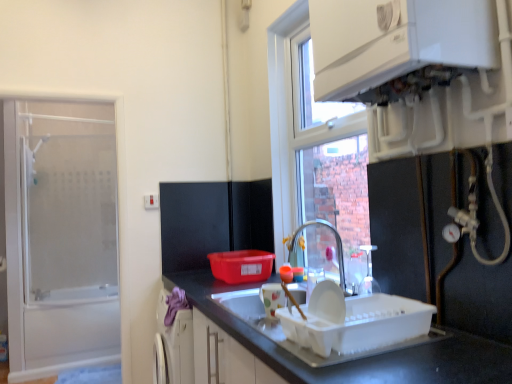
In order to face transparent glass shower door at left, should I rotate leftwards or rightwards?

You should look left and rotate roughly 25.323 degrees.

Measure the distance between point (x=11, y=239) and camera.

They are 3.40 meters apart.

Identify the location of glossy metallic tap at center. The height and width of the screenshot is (384, 512). (336, 245).

Identify the location of white glossy boiler at upper right. (396, 40).

Based on their positions, is glossy metallic tap at center located to the left or right of white glossy countertop at lower center?

In the image, glossy metallic tap at center appears on the right side of white glossy countertop at lower center.

Is point (309, 223) positioned after point (252, 338)?

That is True.

Is glossy metallic tap at center not inside white glossy countertop at lower center?

Yes, glossy metallic tap at center is not within white glossy countertop at lower center.

Considering the sizes of objects glossy metallic tap at center and white glossy countertop at lower center in the image provided, who is smaller, glossy metallic tap at center or white glossy countertop at lower center?

With smaller size is glossy metallic tap at center.

Based on the photo, is glossy metallic tap at center beside white glossy boiler at upper right?

glossy metallic tap at center is not next to white glossy boiler at upper right, and they're not touching.

Is glossy metallic tap at center shorter than white glossy boiler at upper right?

Yes, glossy metallic tap at center is shorter than white glossy boiler at upper right.

From the image's perspective, is glossy metallic tap at center located above white glossy boiler at upper right?

No.

Is glossy metallic tap at center bigger than white glossy boiler at upper right?

No, glossy metallic tap at center is not bigger than white glossy boiler at upper right.

Is point (432, 61) behind point (214, 279)?

No, (432, 61) is in front of (214, 279).

Looking at their sizes, would you say white glossy boiler at upper right is wider or thinner than white glossy countertop at lower center?

white glossy boiler at upper right is thinner than white glossy countertop at lower center.

What are the coordinates of `countertop that is in front of the white glossy boiler at upper right` in the screenshot? It's located at (360, 359).

Is glossy metallic tap at center inside the boundaries of transparent glass shower door at left, or outside?

glossy metallic tap at center exists outside the volume of transparent glass shower door at left.

Between glossy metallic tap at center and transparent glass shower door at left, which one appears on the right side from the viewer's perspective?

glossy metallic tap at center is more to the right.

Which is in front, point (294, 232) or point (106, 362)?

The point (294, 232) is closer.

Is glossy metallic tap at center far away from transparent glass shower door at left?

Yes, glossy metallic tap at center and transparent glass shower door at left are quite far apart.

Is transparent glass shower door at left not close to white glossy boiler at upper right?

Yes.

Is transparent glass shower door at left oriented towards white glossy boiler at upper right?

No, transparent glass shower door at left is not aimed at white glossy boiler at upper right.

Is transparent glass shower door at left smaller than white glossy boiler at upper right?

Incorrect, transparent glass shower door at left is not smaller in size than white glossy boiler at upper right.

Which object is positioned more to the right, transparent glass shower door at left or white glossy boiler at upper right?

white glossy boiler at upper right.

Does white glossy boiler at upper right appear on the left side of glossy metallic tap at center?

Incorrect, white glossy boiler at upper right is not on the left side of glossy metallic tap at center.

Can you tell me how much white glossy boiler at upper right and glossy metallic tap at center differ in facing direction?

The angle between the facing direction of white glossy boiler at upper right and the facing direction of glossy metallic tap at center is 42.6 degrees.

Would you consider white glossy boiler at upper right to be distant from glossy metallic tap at center?

Actually, white glossy boiler at upper right and glossy metallic tap at center are a little close together.

Is point (319, 70) closer or farther from the camera than point (336, 239)?

Point (319, 70) is positioned closer to the camera compared to point (336, 239).

Identify the location of screen door that appears behind the white glossy countertop at lower center. (61, 236).

Which is farther, (22, 147) or (498, 355)?

The point (22, 147) is behind.

Looking at their sizes, would you say transparent glass shower door at left is wider or thinner than white glossy countertop at lower center?

Clearly, transparent glass shower door at left has less width compared to white glossy countertop at lower center.

Considering the positions of objects transparent glass shower door at left and white glossy countertop at lower center in the image provided, who is in front, transparent glass shower door at left or white glossy countertop at lower center?

white glossy countertop at lower center is more forward.

In the image, there is a glossy metallic tap at center. At what (x,y) coordinates should I click in order to perform the action: click on countertop below it (from the image's perspective). Please return your answer as a coordinate pair (x, y). Looking at the image, I should click on (360, 359).

The width and height of the screenshot is (512, 384). What are the coordinates of `cabinetry in front of the glossy metallic tap at center` in the screenshot? It's located at (396, 40).

Estimate the real-world distances between objects in this image. Which object is closer to transparent glass shower door at left, white glossy countertop at lower center or white glossy boiler at upper right?

Based on the image, white glossy countertop at lower center appears to be nearer to transparent glass shower door at left.

Consider the image. Considering their positions, is white glossy boiler at upper right positioned closer to white glossy countertop at lower center than glossy metallic tap at center?

Among the two, glossy metallic tap at center is located nearer to white glossy countertop at lower center.

Which object lies nearer to the anchor point white glossy boiler at upper right, transparent glass shower door at left or white glossy countertop at lower center?

white glossy countertop at lower center.

Based on their spatial positions, is glossy metallic tap at center or transparent glass shower door at left further from white glossy countertop at lower center?

transparent glass shower door at left.

Based on their spatial positions, is transparent glass shower door at left or white glossy countertop at lower center closer to glossy metallic tap at center?

Among the two, white glossy countertop at lower center is located nearer to glossy metallic tap at center.

Which object lies further to the anchor point glossy metallic tap at center, white glossy boiler at upper right or transparent glass shower door at left?

Based on the image, transparent glass shower door at left appears to be further to glossy metallic tap at center.

Estimate the real-world distances between objects in this image. Which object is closer to white glossy boiler at upper right, glossy metallic tap at center or transparent glass shower door at left?

Among the two, glossy metallic tap at center is located nearer to white glossy boiler at upper right.

From the picture: Considering their positions, is white glossy boiler at upper right positioned closer to white glossy countertop at lower center than transparent glass shower door at left?

white glossy boiler at upper right.

Where is `countertop located between transparent glass shower door at left and glossy metallic tap at center in the left-right direction`? The height and width of the screenshot is (384, 512). countertop located between transparent glass shower door at left and glossy metallic tap at center in the left-right direction is located at coordinates (360, 359).

Where is `tap between white glossy boiler at upper right and white glossy countertop at lower center vertically`? The height and width of the screenshot is (384, 512). tap between white glossy boiler at upper right and white glossy countertop at lower center vertically is located at coordinates (336, 245).

Find the location of `tap between transparent glass shower door at left and white glossy boiler at upper right from left to right`. tap between transparent glass shower door at left and white glossy boiler at upper right from left to right is located at coordinates (336, 245).

Identify the location of countertop between transparent glass shower door at left and white glossy boiler at upper right in the horizontal direction. (360, 359).